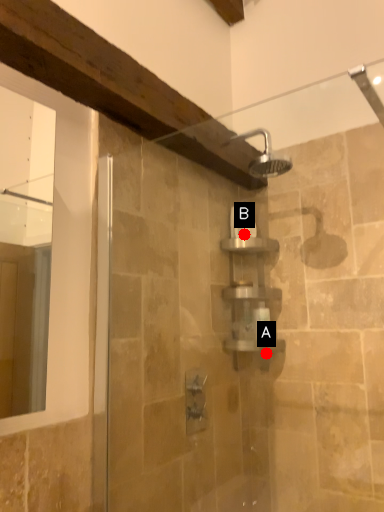
Question: Two points are circled on the image, labeled by A and B beside each circle. Which point is farther from the camera taking this photo?

Choices:
 (A) A is further
 (B) B is further

Answer: (B)